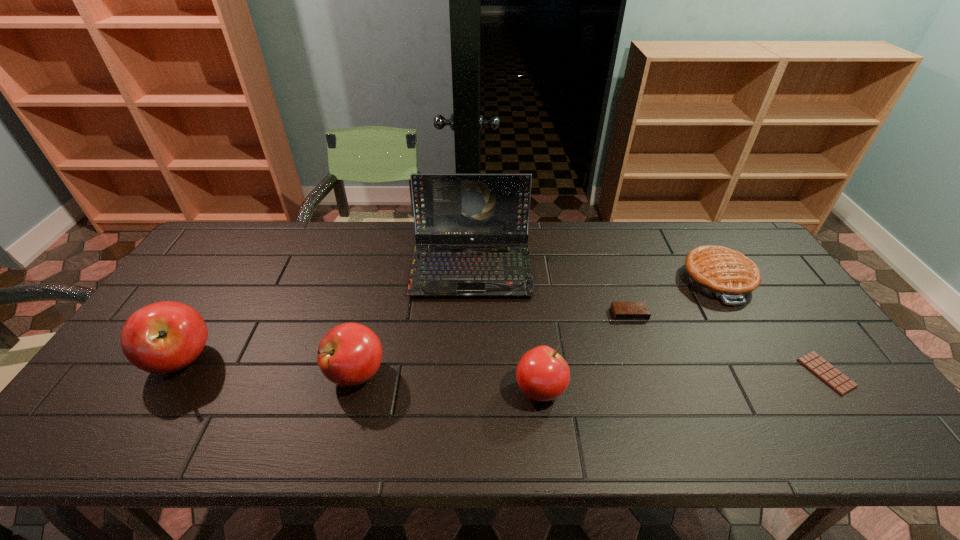
Please point a vacant point for placing a apple on the right. Please provide its 2D coordinates. Your answer should be formatted as a tuple, i.e. [(x, y)], where the tuple contains the x and y coordinates of a point satisfying the conditions above.

[(736, 406)]